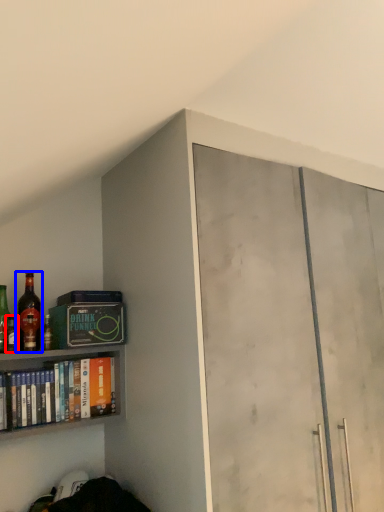
Question: Which object appears farthest to the camera in this image, bottle (highlighted by a red box) or bottle (highlighted by a blue box)?

Choices:
 (A) bottle
 (B) bottle

Answer: (B)